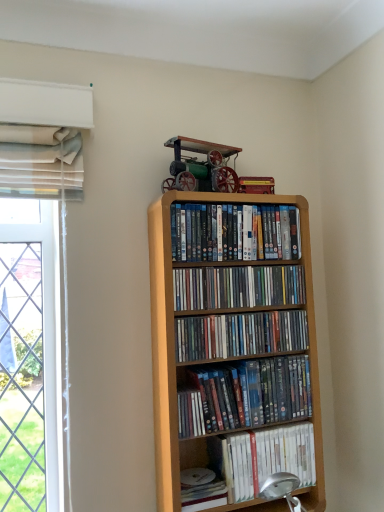
Question: Would you say white matte paperback book at lower center is to the left or to the right of matte plastic dvds at upper center, the first book viewed from the top, in the picture?

Choices:
 (A) right
 (B) left

Answer: (B)

Question: From the image's perspective, relative to matte plastic dvds at upper center, which is the 5th book in bottom-to-top order, is white matte paperback book at lower center above or below?

Choices:
 (A) above
 (B) below

Answer: (B)

Question: Which object is the farthest from the matte plastic dvds at upper center, which is the 5th book in bottom-to-top order?

Choices:
 (A) white matte paperback book at lower center
 (B) matte plastic dvds at center, placed as the 2th book when sorted from top to bottom
 (C) matte plastic dvds at center, the 3th book positioned from the bottom
 (D) white matte book at lower right, the 5th book in the top-to-bottom sequence
 (E) light wood bookcase at center

Answer: (A)

Question: Considering the real-world distances, which object is farthest from the matte plastic dvds at upper center, which is the 5th book in bottom-to-top order?

Choices:
 (A) light wood bookcase at center
 (B) white matte book at lower right, marked as the 1th book in a bottom-to-top arrangement
 (C) matte plastic dvds at center, placed as the 2th book when sorted from top to bottom
 (D) matte plastic dvds at center, positioned as the 2th book in bottom-to-top order
 (E) matte plastic dvds at center, the 3th book when ordered from top to bottom

Answer: (B)